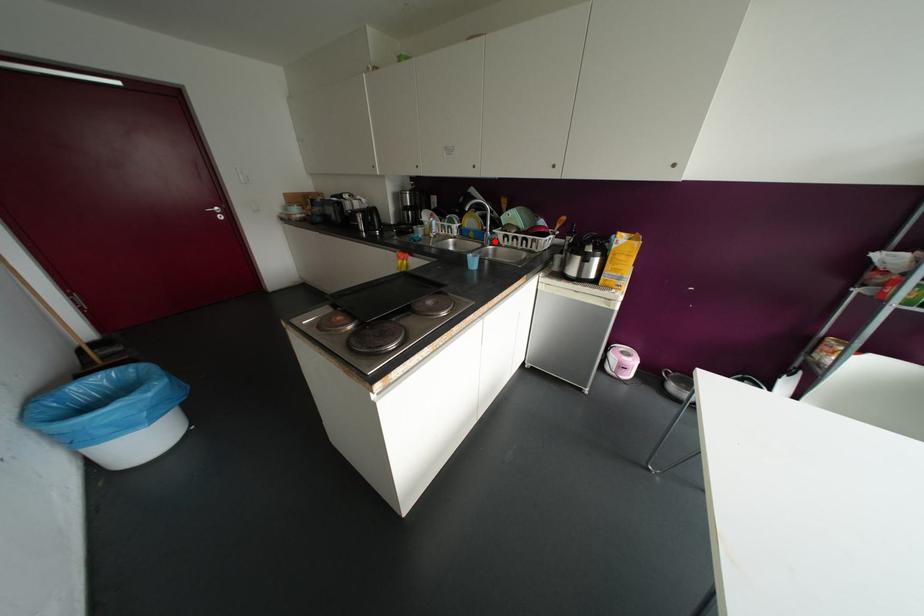
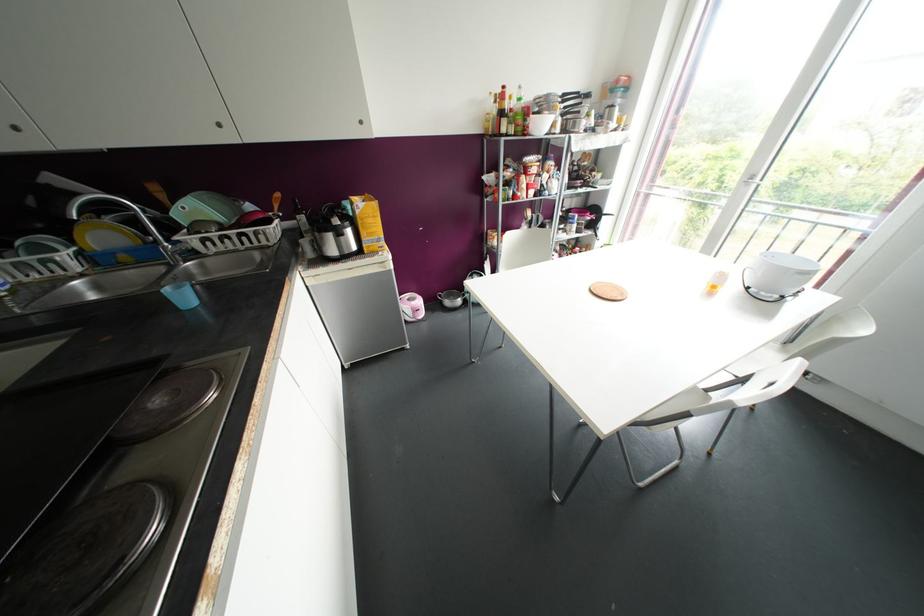
The point at the highlighted location is marked in the first image. Where is the corresponding point in the second image?

(192, 253)